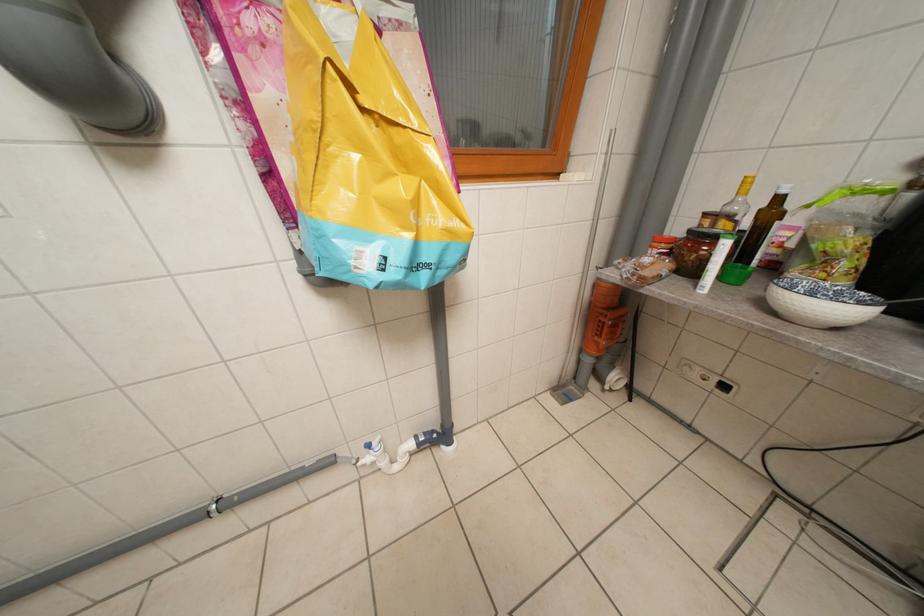
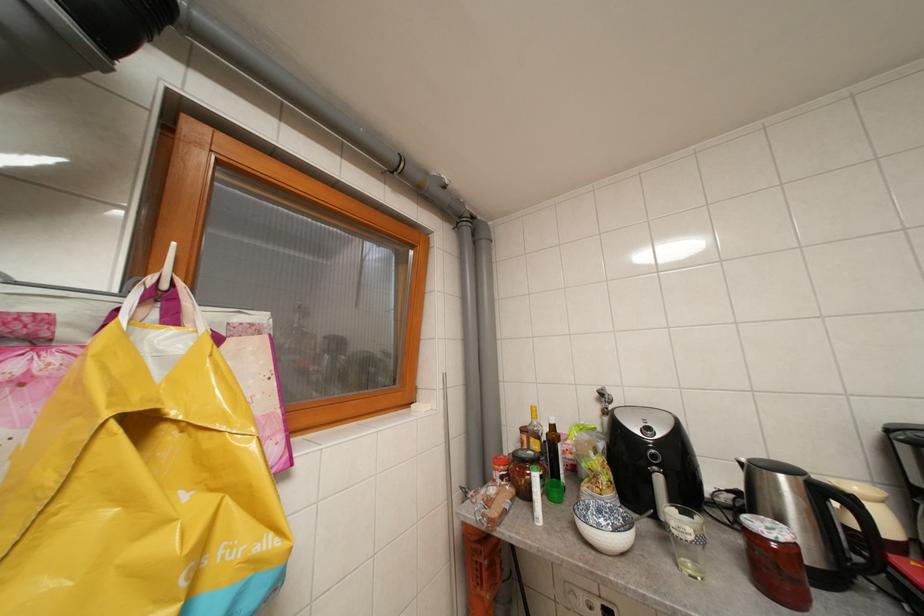
Based on the continuous images, in which direction is the camera rotating?

The camera rotated toward right-up.